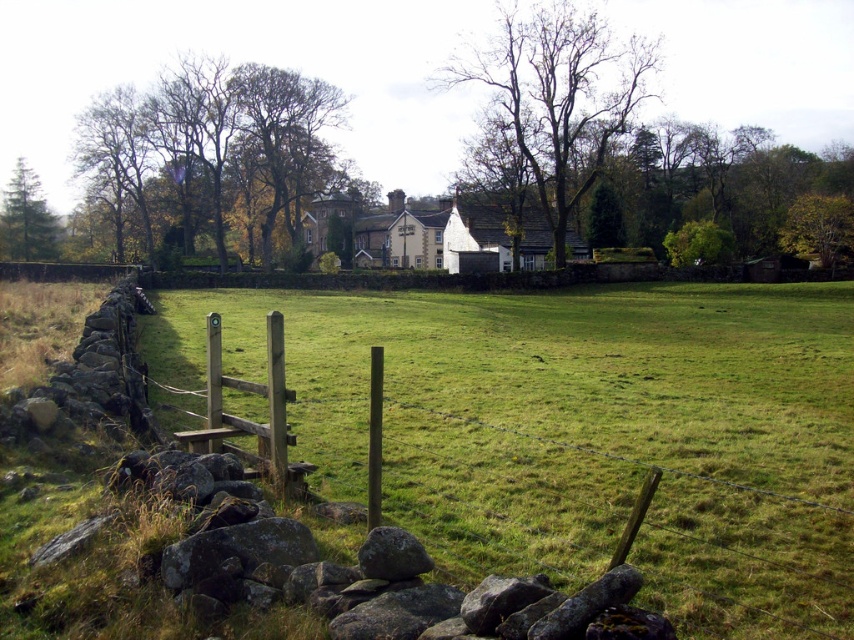
You are planning to plant a new tree in this rural landscape. The brown leafy tree at upper left and the green leafy tree at upper right are already present. Which existing tree has a wider canopy spread that might require more space when planning the new tree?

The brown leafy tree at upper left has a larger width than the green leafy tree at upper right, so it has a wider canopy spread and requires more space.

You are standing at the center of the field and want to locate the brown leafy tree at upper left. Which direction should you face to see it?

The brown leafy tree at upper left is located at point coordinates of (209, 152), so you should face the upper left direction to see it.